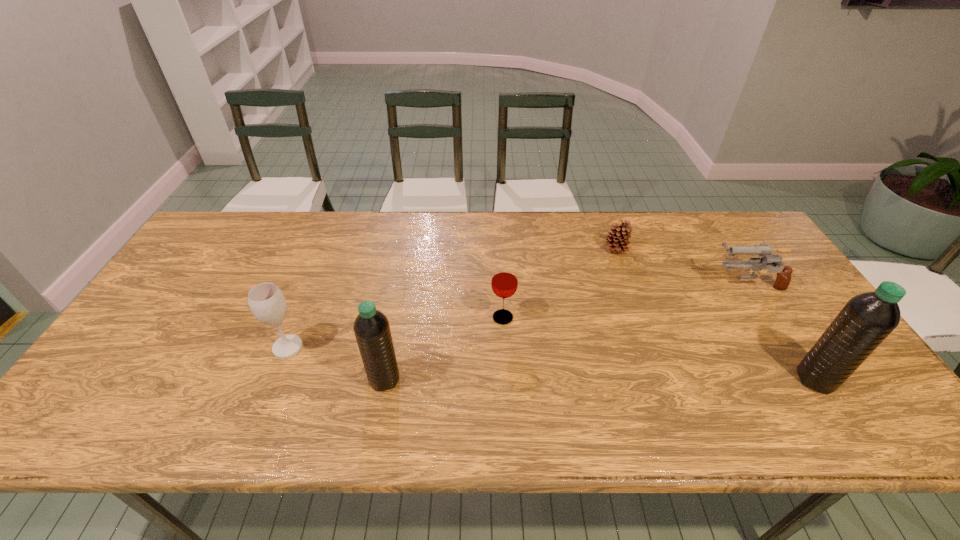
Identify the location of gun. (783, 278).

Locate an element on the screen. The image size is (960, 540). the fifth tallest object is located at coordinates (783, 278).

You are a GUI agent. You are given a task and a screenshot of the screen. Output one action in this format:
    pyautogui.click(x=<x>, y=<y>)
    Task: Click on the free space located on the back of the fifth shortest object
    This screenshot has width=960, height=540.
    Given the screenshot: What is the action you would take?
    pyautogui.click(x=407, y=259)

Image resolution: width=960 pixels, height=540 pixels. What are the coordinates of `free space located 0.070m on the back of the right water bottle` in the screenshot? It's located at (791, 341).

Locate an element on the screen. The height and width of the screenshot is (540, 960). free space located on the front of the shortest object is located at coordinates (632, 295).

The height and width of the screenshot is (540, 960). Find the location of `blank space located on the front of the fourth nearest object`. blank space located on the front of the fourth nearest object is located at coordinates (504, 342).

This screenshot has width=960, height=540. I want to click on vacant space located on the left of the third nearest object, so click(142, 348).

I want to click on vacant area situated 0.070m at the barrel end of the second farthest object, so click(686, 284).

The image size is (960, 540). I want to click on vacant area located 0.200m at the barrel end of the second farthest object, so click(x=642, y=284).

Where is `vacant point located at the barrel end of the second farthest object`? vacant point located at the barrel end of the second farthest object is located at coordinates (632, 284).